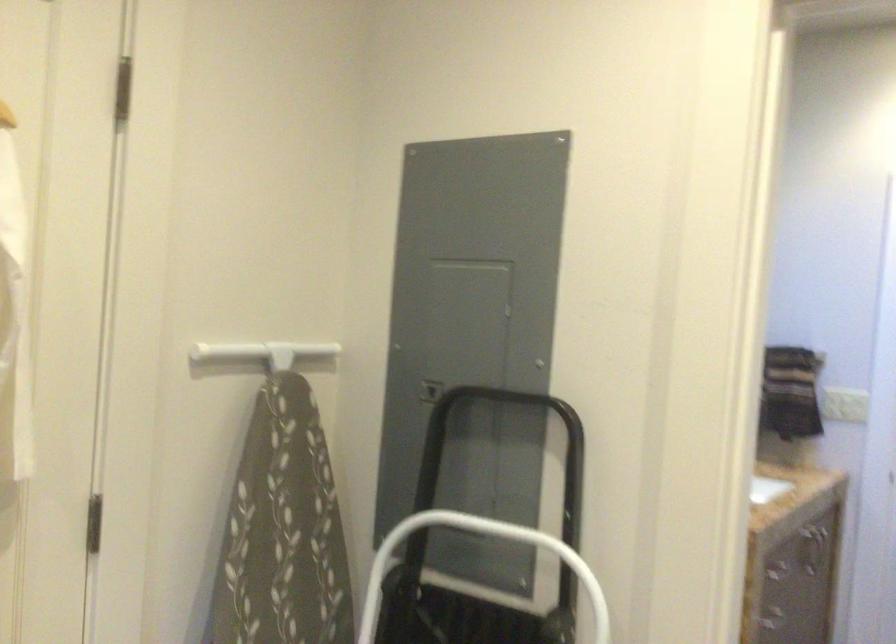
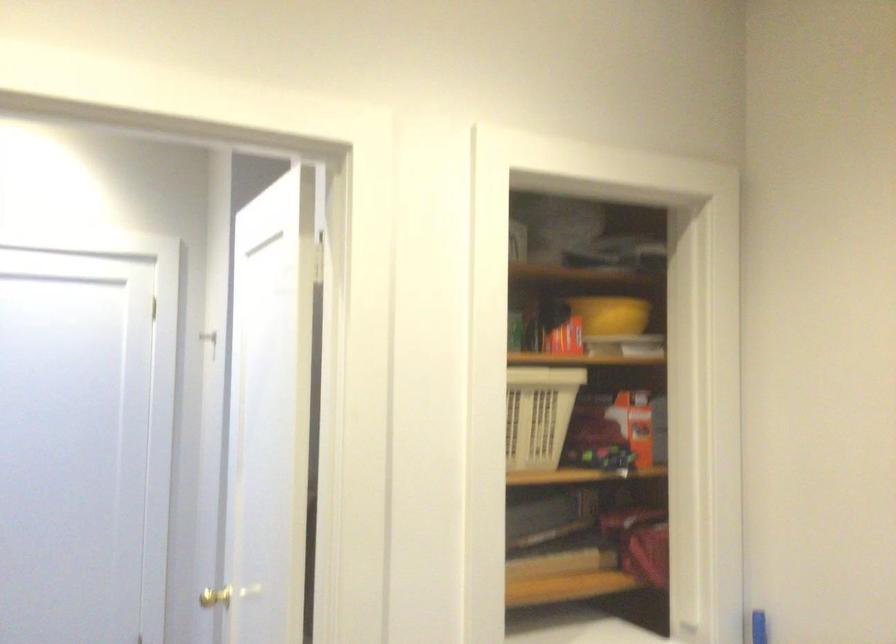
Question: The camera is either moving clockwise (left) or counter-clockwise (right) around the object. The first image is from the beginning of the video and the second image is from the end. Is the camera moving left or right when shooting the video?

Choices:
 (A) Left
 (B) Right

Answer: (A)